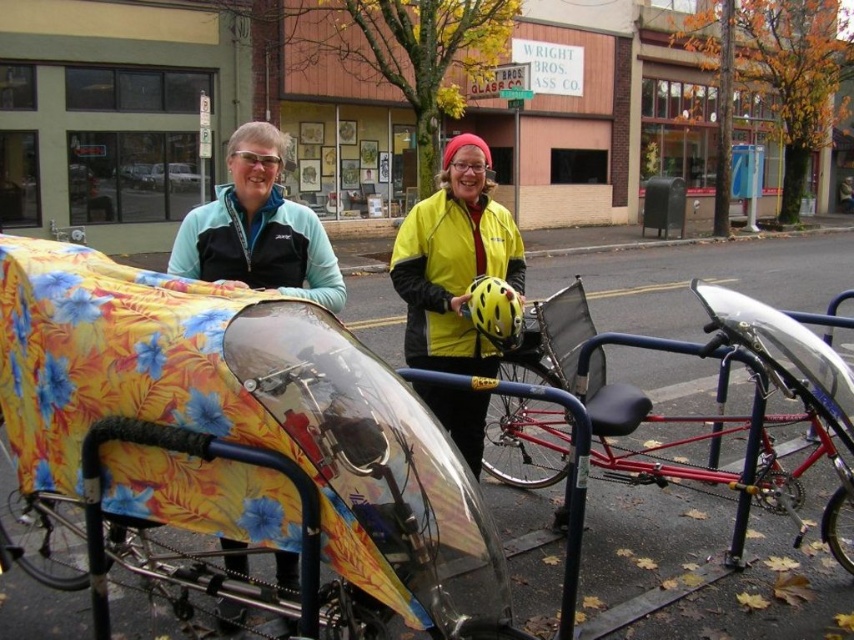
Which of these two, metallic red bicycle at center or yellow matte jacket at center, stands taller?

With more height is yellow matte jacket at center.

Can you confirm if metallic red bicycle at center is taller than yellow matte jacket at center?

No, metallic red bicycle at center is not taller than yellow matte jacket at center.

Image resolution: width=854 pixels, height=640 pixels. What are the coordinates of `metallic red bicycle at center` in the screenshot? It's located at (717, 401).

This screenshot has height=640, width=854. In order to click on metallic red bicycle at center in this screenshot , I will do `click(717, 401)`.